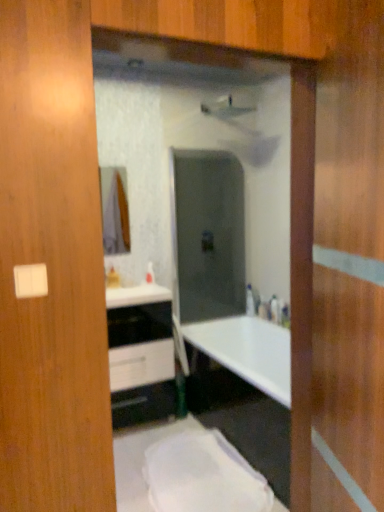
Question: Are white glossy cabinet at center and satin nickel faucet at center located far from each other?

Choices:
 (A) no
 (B) yes

Answer: (B)

Question: From the image's perspective, is white glossy cabinet at center located above satin nickel faucet at center?

Choices:
 (A) no
 (B) yes

Answer: (A)

Question: Is white glossy cabinet at center with satin nickel faucet at center?

Choices:
 (A) no
 (B) yes

Answer: (A)

Question: Is white glossy cabinet at center facing away from satin nickel faucet at center?

Choices:
 (A) no
 (B) yes

Answer: (A)

Question: Is white glossy cabinet at center thinner than satin nickel faucet at center?

Choices:
 (A) no
 (B) yes

Answer: (A)

Question: Does white glossy cabinet at center have a greater width compared to satin nickel faucet at center?

Choices:
 (A) yes
 (B) no

Answer: (A)

Question: Does satin nickel faucet at center come behind white glossy cabinet at center?

Choices:
 (A) no
 (B) yes

Answer: (B)

Question: Considering the relative sizes of satin nickel faucet at center and white glossy cabinet at center in the image provided, is satin nickel faucet at center shorter than white glossy cabinet at center?

Choices:
 (A) yes
 (B) no

Answer: (A)

Question: Is satin nickel faucet at center beside white glossy cabinet at center?

Choices:
 (A) no
 (B) yes

Answer: (A)

Question: Does satin nickel faucet at center appear on the left side of white glossy cabinet at center?

Choices:
 (A) no
 (B) yes

Answer: (A)

Question: Is white glossy cabinet at center a part of satin nickel faucet at center?

Choices:
 (A) no
 (B) yes

Answer: (A)

Question: Is satin nickel faucet at center at the right side of white glossy cabinet at center?

Choices:
 (A) no
 (B) yes

Answer: (B)

Question: From the image's perspective, is satin nickel faucet at center located above or below white glossy cabinet at center?

Choices:
 (A) below
 (B) above

Answer: (B)